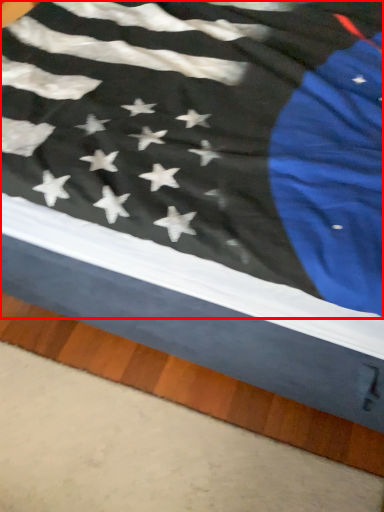
Question: From the image, what is the correct spatial relationship of flag (annotated by the red box) in relation to plank?

Choices:
 (A) right
 (B) left

Answer: (A)